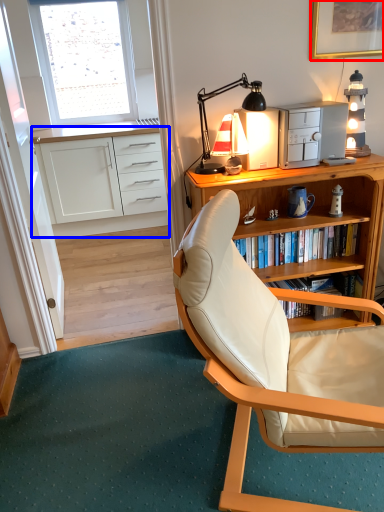
Question: Which object appears closest to the camera in this image, picture frame (highlighted by a red box) or cabinetry (highlighted by a blue box)?

Choices:
 (A) picture frame
 (B) cabinetry

Answer: (A)